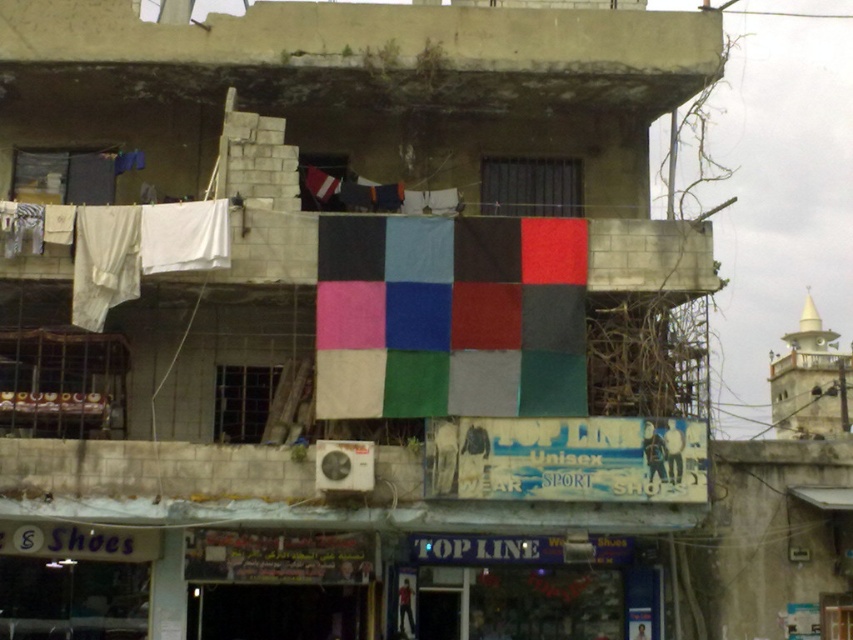
In the scene shown: Which is more to the right, textile flag at center or matte fabric flag at upper center?

Positioned to the right is textile flag at center.

Who is more distant from viewer, [503,292] or [332,184]?

The point [332,184] is behind.

Between point (386, 412) and point (323, 198), which one is positioned behind?

The point (323, 198) is behind.

Identify the location of textile flag at center. (450, 316).